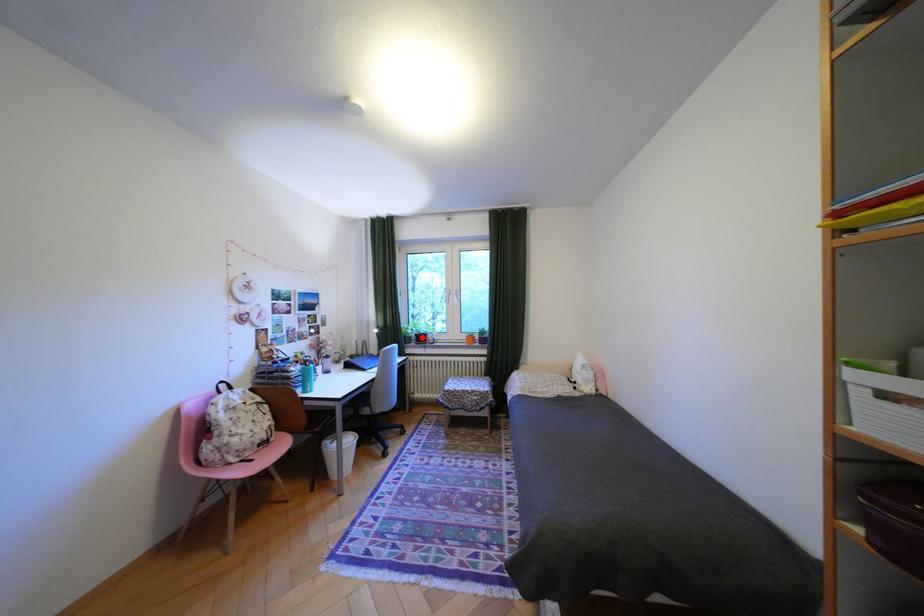
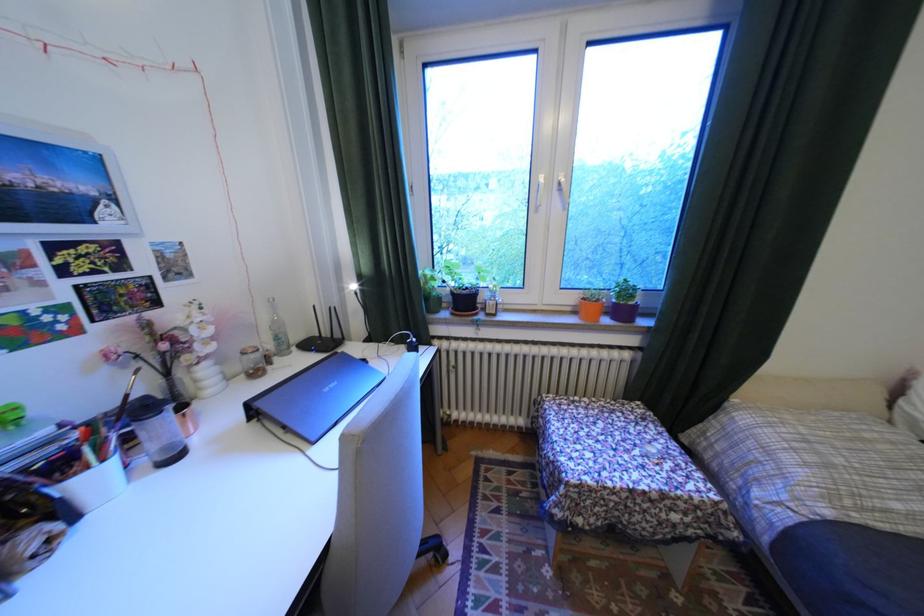
Locate, in the second image, the point that corresponds to the highlighted location in the first image.

(451, 299)